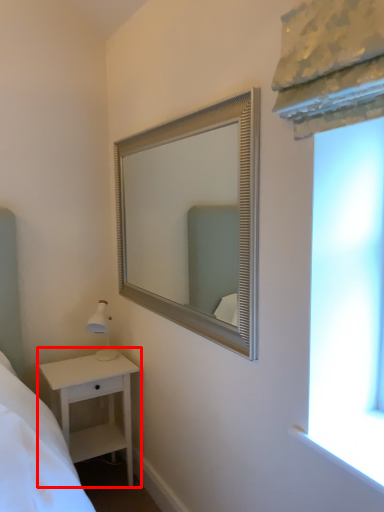
Question: From the image's perspective, what is the correct spatial relationship of nightstand (annotated by the red box) in relation to mirror?

Choices:
 (A) above
 (B) below

Answer: (B)